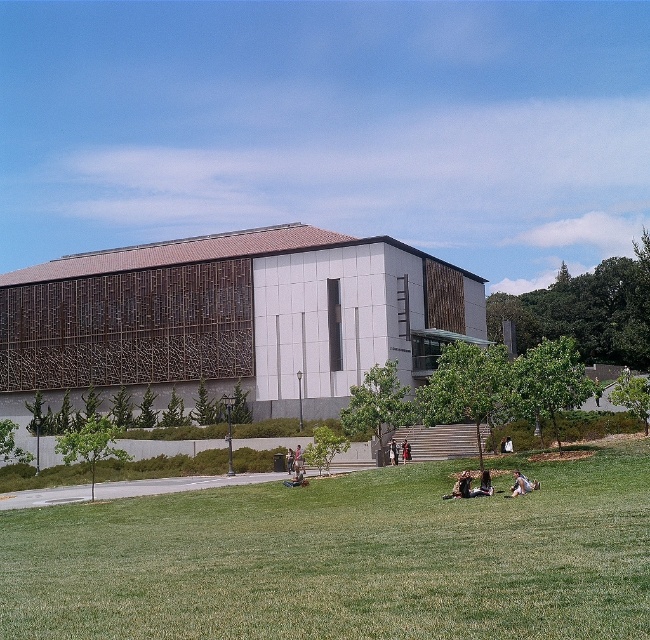
You are standing in front of the modern building and want to place a small picnic basket on the green grass at lower center. However, there is a dark brown leather jacket at center in the way. Can you move the jacket to access the grass?

The green grass at lower center is closer to the viewer than the dark brown leather jacket at center, so the jacket is between you and the grass. You would need to move the jacket to reach the grass.

You are standing on the lawn in front of the building and see the light brown fabric person at lower right and the denim jacket at center. Which one is closer to you?

The light brown fabric person at lower right is closer to you because they are in front of the denim jacket at center.

You are planning to place a picnic blanket on the green grass at lower center. Considering the size of the dark brown leather jacket at center, will there be enough space for the blanket?

The green grass at lower center is bigger than the dark brown leather jacket at center, so there should be enough space to place the picnic blanket there.